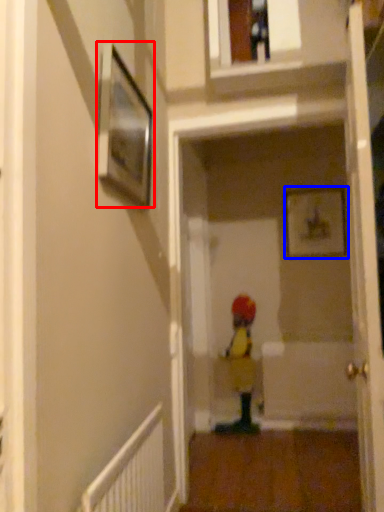
Question: Among these objects, which one is farthest to the camera, picture frame (highlighted by a red box) or picture frame (highlighted by a blue box)?

Choices:
 (A) picture frame
 (B) picture frame

Answer: (B)